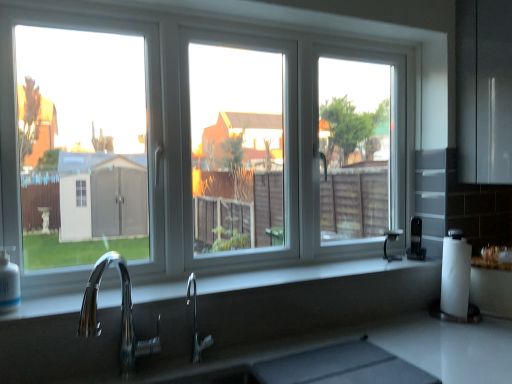
Question: Is smooth gray countertop at center wider or thinner than white plastic window at center?

Choices:
 (A) thin
 (B) wide

Answer: (B)

Question: In terms of height, does smooth gray countertop at center look taller or shorter compared to white plastic window at center?

Choices:
 (A) tall
 (B) short

Answer: (B)

Question: Which object is positioned closest to the black plastic coffee maker at right?

Choices:
 (A) polished chrome faucet at center, placed as the first tap when sorted from back to front
 (B) smooth gray countertop at center
 (C) white plastic window at center
 (D) chrome/metallic faucet at lower left, acting as the second tap starting from the back

Answer: (B)

Question: Which object is positioned closest to the black plastic coffee maker at right?

Choices:
 (A) smooth gray countertop at center
 (B) chrome/metallic faucet at lower left, the second tap from the right
 (C) white plastic window at center
 (D) polished chrome faucet at center, the first tap viewed from the right

Answer: (A)